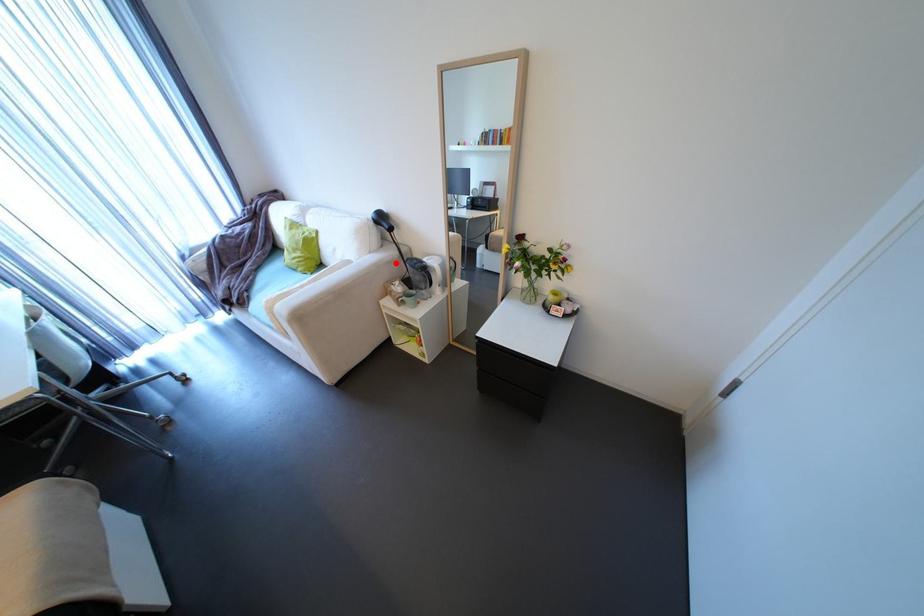
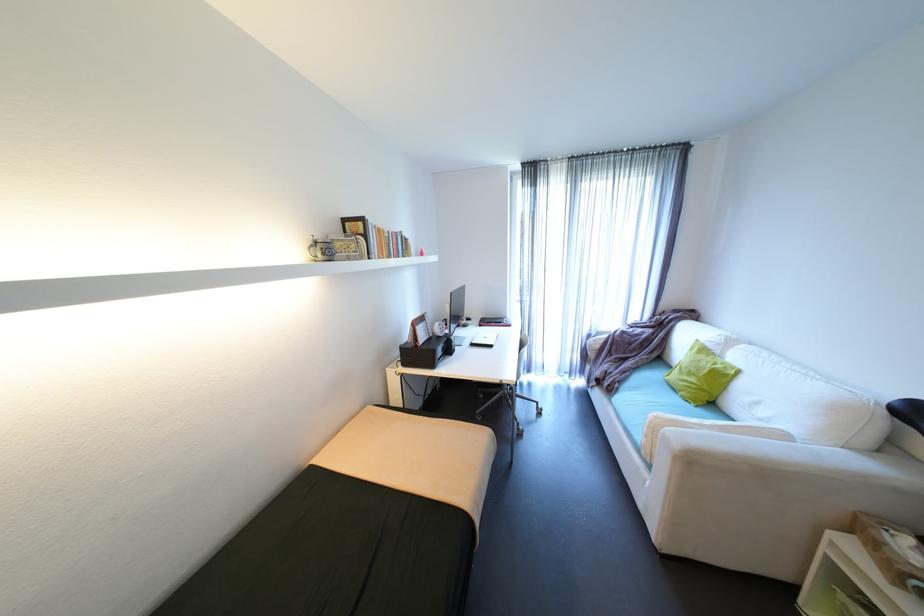
In the second image, find the point that corresponds to the highlighted location in the first image.

(907, 493)